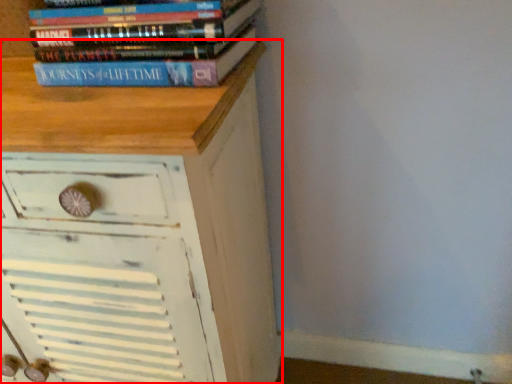
Question: From the image's perspective, where is chest of drawers (annotated by the red box) located relative to book?

Choices:
 (A) above
 (B) below

Answer: (B)